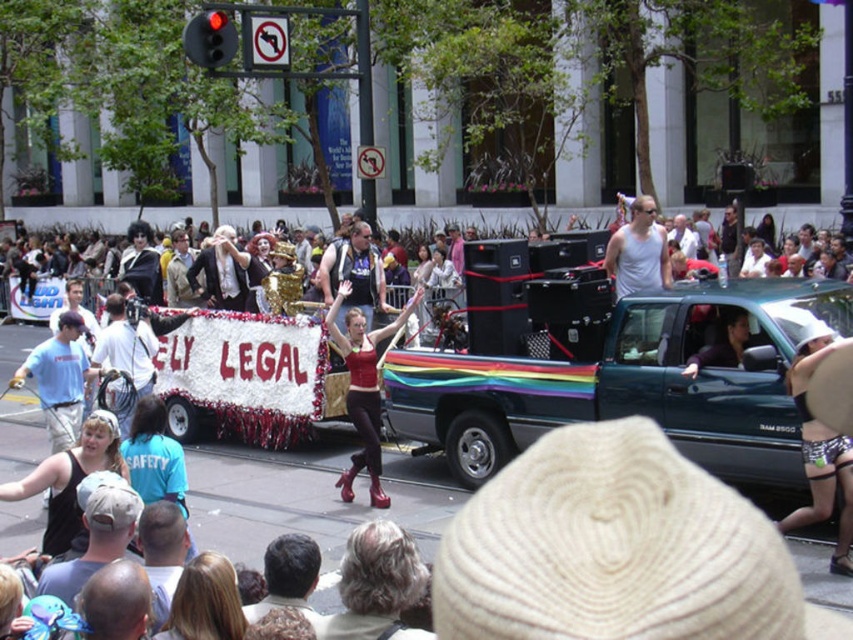
Question: Which point is farther to the camera?

Choices:
 (A) (357, 227)
 (B) (352, 362)
 (C) (155, 292)

Answer: (A)

Question: Is shiny red boots at center bigger than shiny black wig at left?

Choices:
 (A) yes
 (B) no

Answer: (B)

Question: Which object appears closest to the camera in this image?

Choices:
 (A) matte black tank top at center
 (B) shiny black wig at left
 (C) shiny red boots at center

Answer: (C)

Question: Which point is closer to the camera?

Choices:
 (A) (344, 493)
 (B) (144, 225)

Answer: (A)

Question: Does shiny red boots at center appear on the left side of matte black tank top at center?

Choices:
 (A) yes
 (B) no

Answer: (B)

Question: Can you confirm if shiny red boots at center is thinner than shiny black wig at left?

Choices:
 (A) yes
 (B) no

Answer: (A)